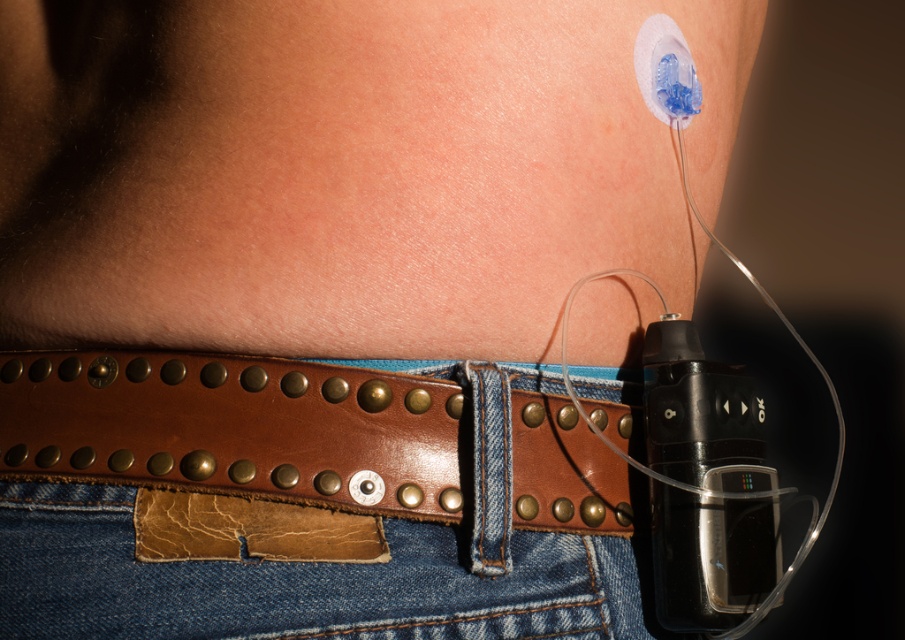
Consider the image. Can you confirm if brown leather belt at lower center is thinner than leather/cracked at center?

No, brown leather belt at lower center is not thinner than leather/cracked at center.

Does point (65, 456) lie in front of point (313, 524)?

No, (65, 456) is behind (313, 524).

Identify the location of brown leather belt at lower center. (311, 451).